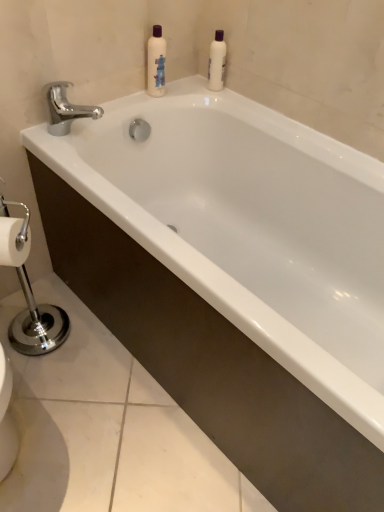
Image resolution: width=384 pixels, height=512 pixels. In order to click on free space that is to the left of white plastic bottle at upper center, the 1th cleaning product positioned from the right in this screenshot , I will do `click(189, 84)`.